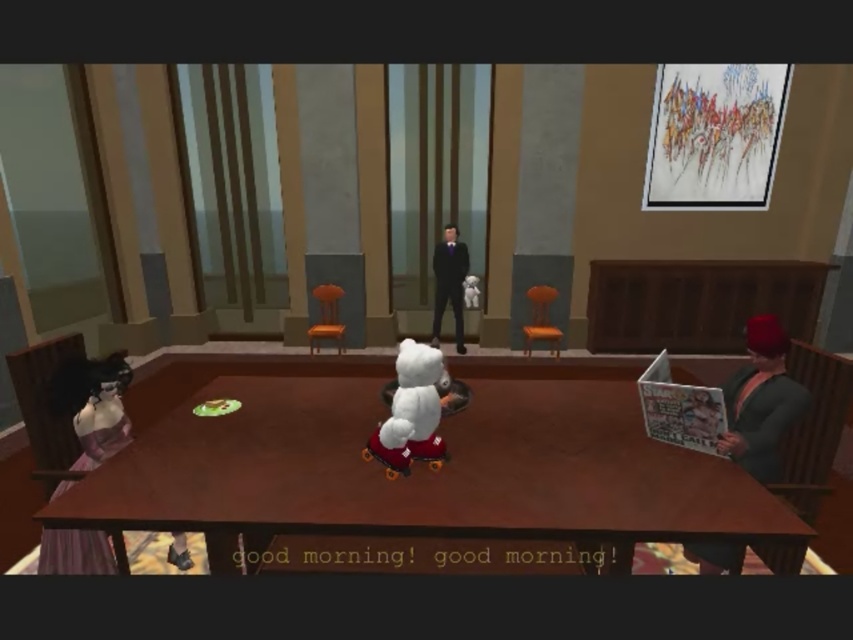
You are standing in the room and want to sit down on the yellow matte chair at center. Which direction should you move relative to the wooden chair at center?

The yellow matte chair at center is to the right of the wooden chair at center, so you should move to the right side of the wooden chair at center to reach the yellow matte chair at center.